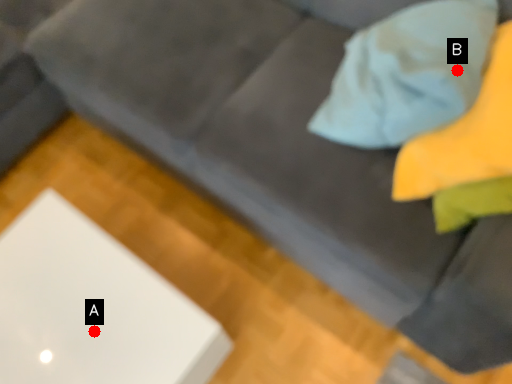
Question: Two points are circled on the image, labeled by A and B beside each circle. Which of the following is the farthest from the observer?

Choices:
 (A) A is further
 (B) B is further

Answer: (A)